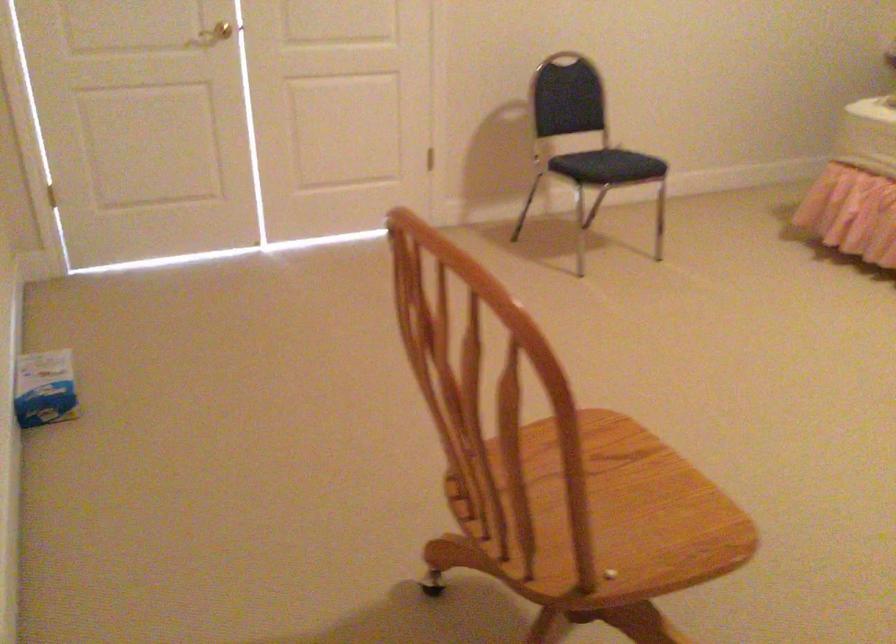
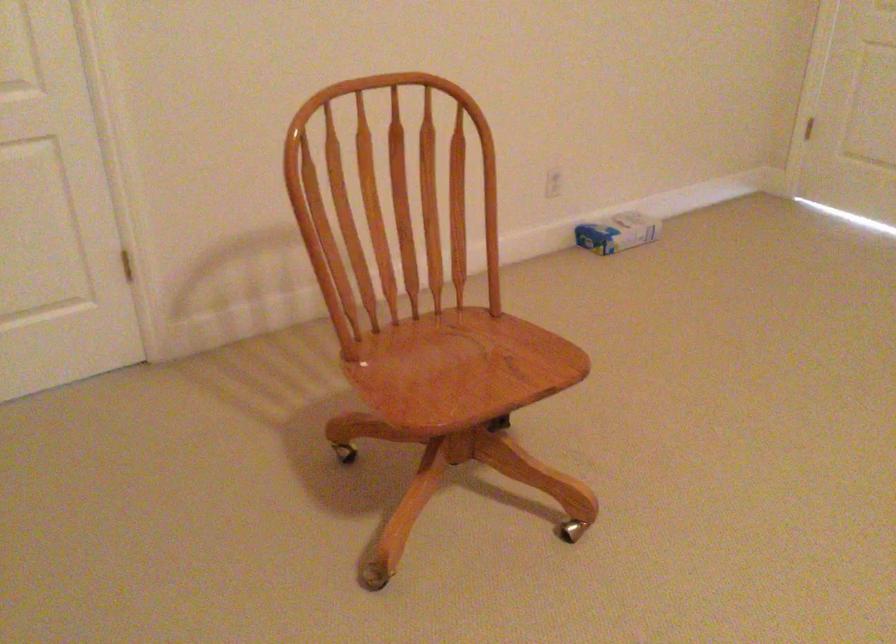
Find the pixel in the second image that matches (x=95, y=377) in the first image.

(616, 232)